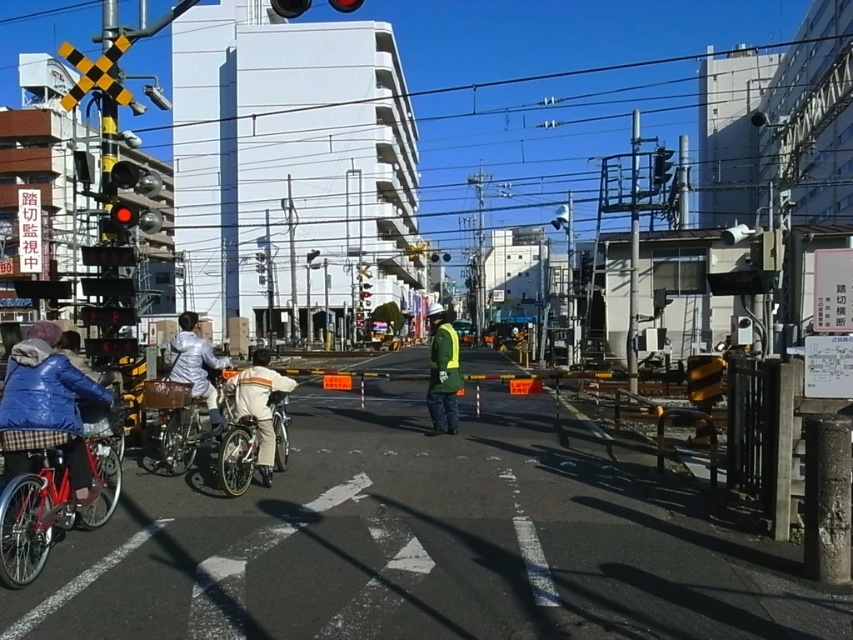
Consider the image. You are a delivery person planning to park your shiny red bicycle at lower left near the traffic light. The traffic light is at point (51, 506). Is the traffic light red?

The point (51, 506) corresponds to the shiny red bicycle at lower left, so the traffic light is not at that point. The traffic light mentioned in the scene description is red, so it is red.